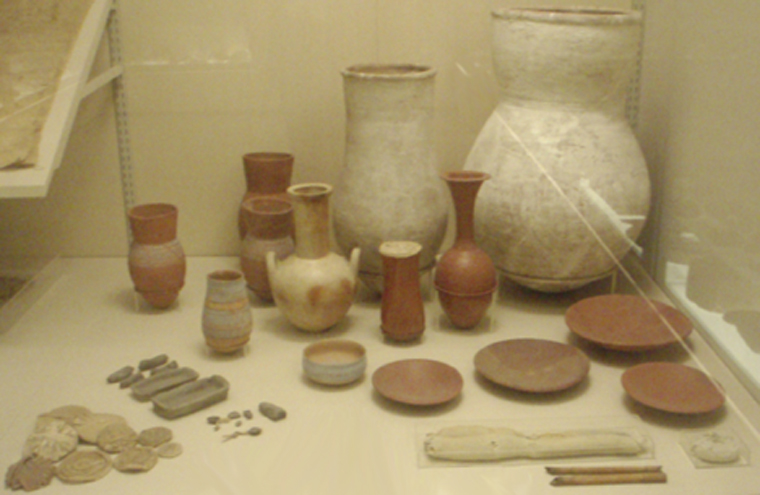
You are a GUI agent. You are given a task and a screenshot of the screen. Output one action in this format:
    pyautogui.click(x=<x>, y=<y>)
    Task: Click on the pottery
    The image size is (760, 495).
    Given the screenshot: What is the action you would take?
    pyautogui.click(x=549, y=196), pyautogui.click(x=466, y=266), pyautogui.click(x=406, y=195), pyautogui.click(x=401, y=276), pyautogui.click(x=311, y=277), pyautogui.click(x=324, y=355), pyautogui.click(x=233, y=322), pyautogui.click(x=255, y=238), pyautogui.click(x=258, y=171), pyautogui.click(x=157, y=260)